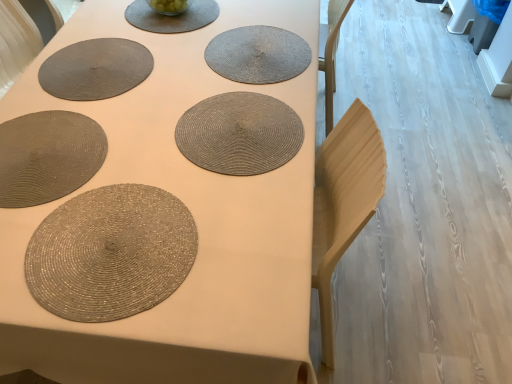
This screenshot has width=512, height=384. Find the location of `empty space that is to the right of matte gray placemat at upper center`. empty space that is to the right of matte gray placemat at upper center is located at coordinates (243, 26).